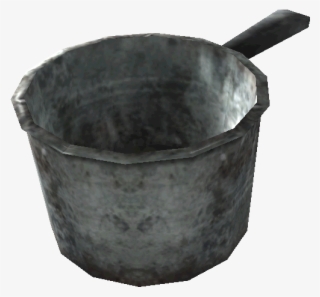
Identify the location of points on the edge of the cup rim. This screenshot has height=297, width=320. (12, 99), (21, 127), (61, 152), (125, 164), (190, 158), (241, 138), (269, 107), (267, 76), (240, 52).